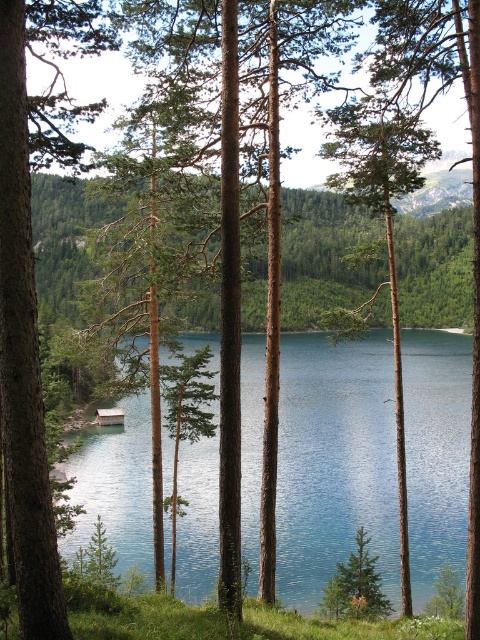
You are standing at the point marked as point (335, 461) in the image. What do you see directly in front of you?

At point (335, 461) lies blue glassy water at center, so you see blue glassy water at center directly in front of you.

You are planning to build a small boat dock near the blue glassy water at center. The dock needs to be as wide as the green rough bark tree at center. Can you safely assume the water is wide enough to accommodate the dock without overhanging into the tree?

The blue glassy water at center might be wider than green rough bark tree at center, so there is a possibility that the water is wide enough for the dock. However, since the exact width difference isn not specified, there is uncertainty and further measurement is recommended.

Based on the photo, you are a hiker standing in the middle of the green matte pine forest at center and the green rough bark tree at center. You want to take a photo of the lake behind you. Which object should you move away from to get a clearer view of the lake?

The green matte pine forest at center is positioned under the green rough bark tree at center, so you should move away from the green matte pine forest at center to get a clearer view of the lake.